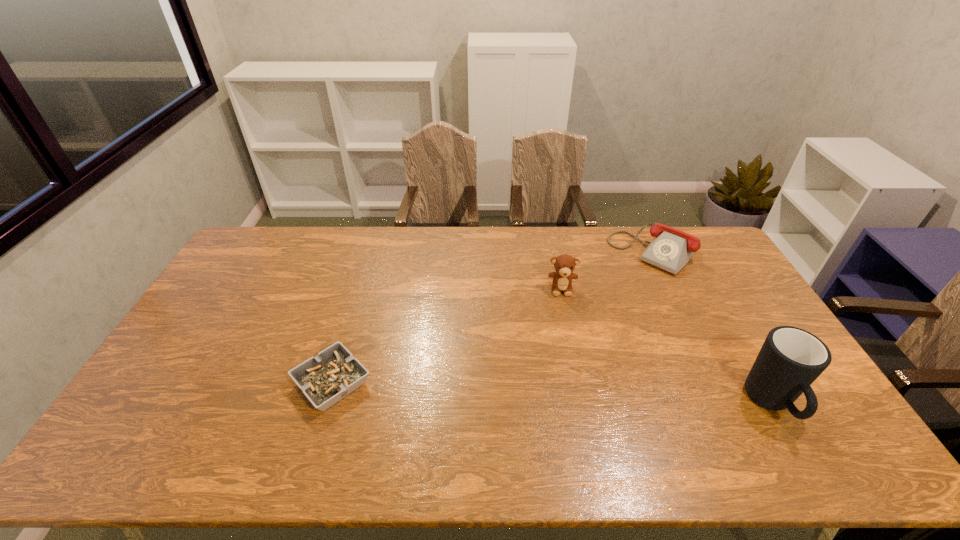
This screenshot has height=540, width=960. Find the location of `free space that satisfies the following two spatial constraints: 1. on the back side of the third nearest object; 2. on the left side of the shortest object`. free space that satisfies the following two spatial constraints: 1. on the back side of the third nearest object; 2. on the left side of the shortest object is located at coordinates (361, 288).